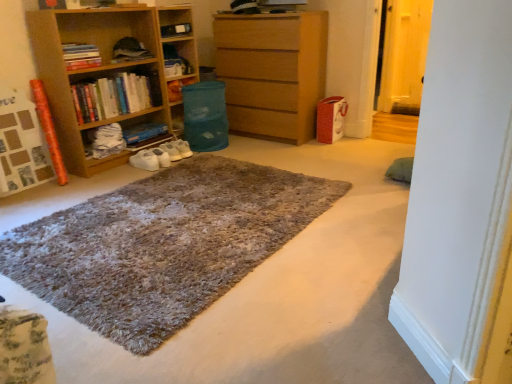
Locate an element on the screen. This screenshot has height=384, width=512. free space in front of wooden chest of drawers at center is located at coordinates (271, 152).